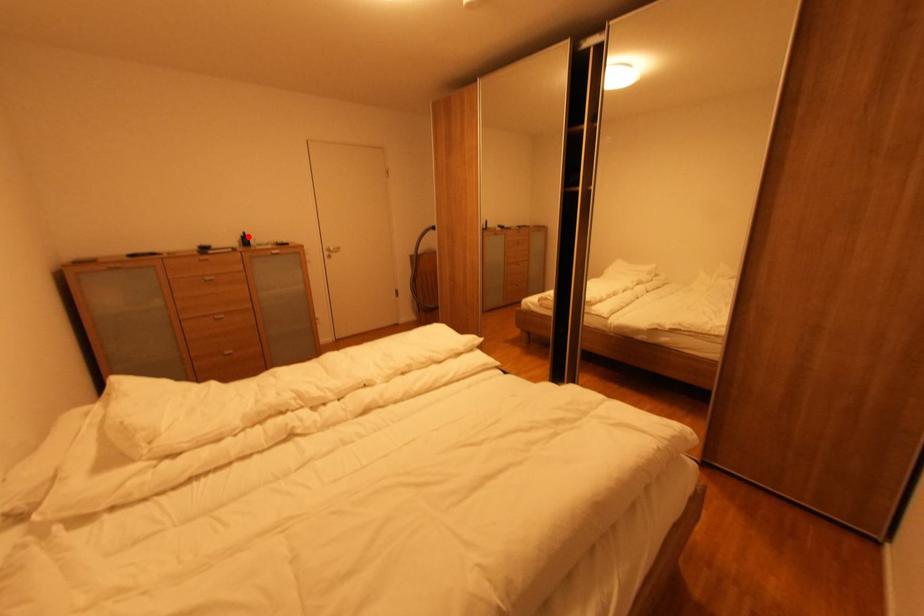
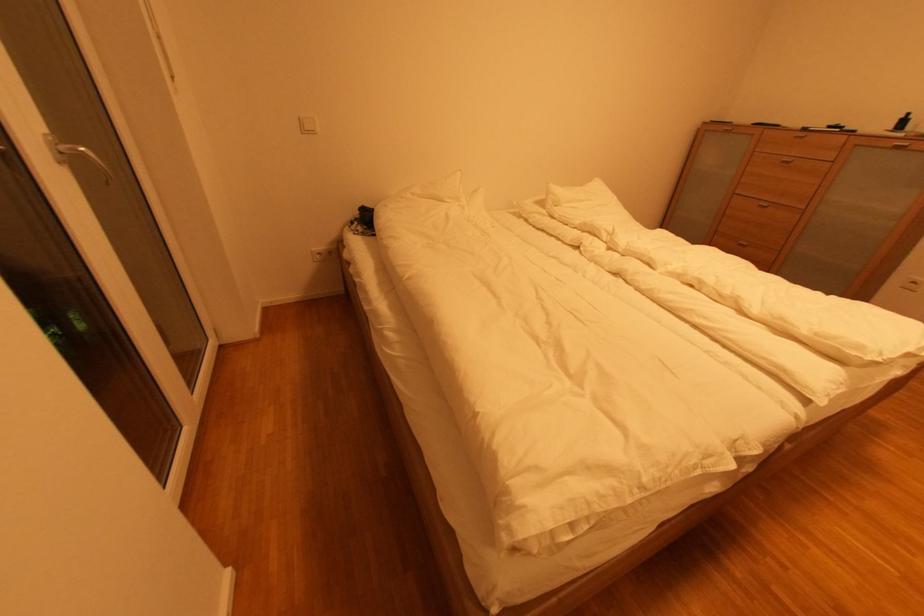
Where in the second image is the point corresponding to the highlighted location from the first image?

(908, 118)